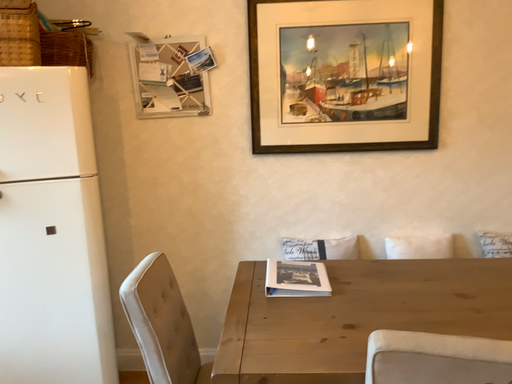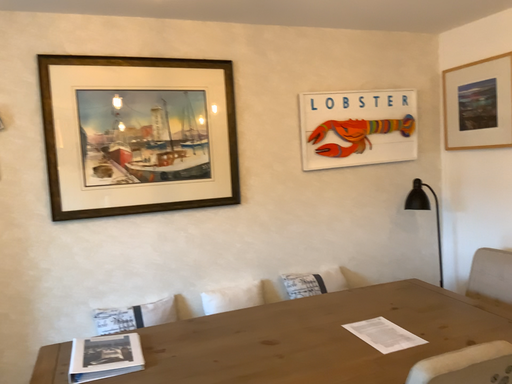
Question: Which way did the camera rotate in the video?

Choices:
 (A) rotated upward
 (B) rotated downward

Answer: (A)